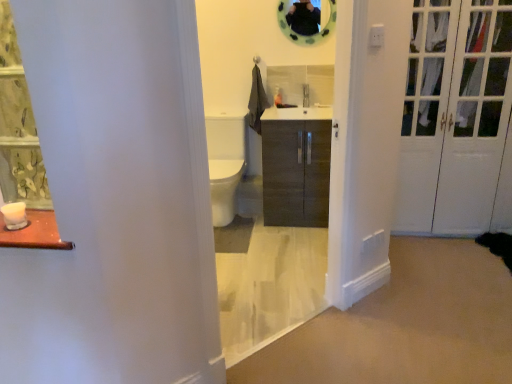
Question: From the image's perspective, is white glossy door at right located above green rubber mirror at upper center?

Choices:
 (A) yes
 (B) no

Answer: (B)

Question: From the image's perspective, is white glossy door at right under green rubber mirror at upper center?

Choices:
 (A) yes
 (B) no

Answer: (A)

Question: Would you say green rubber mirror at upper center is part of white glossy door at right's contents?

Choices:
 (A) yes
 (B) no

Answer: (B)

Question: Does white glossy door at right have a greater width compared to green rubber mirror at upper center?

Choices:
 (A) no
 (B) yes

Answer: (B)

Question: Considering the relative positions of white glossy door at right and green rubber mirror at upper center in the image provided, is white glossy door at right behind green rubber mirror at upper center?

Choices:
 (A) no
 (B) yes

Answer: (A)

Question: Does white glossy door at right come in front of green rubber mirror at upper center?

Choices:
 (A) no
 (B) yes

Answer: (B)

Question: Is matte wood cabinet at center closer to camera compared to white glossy door at right?

Choices:
 (A) no
 (B) yes

Answer: (B)

Question: Is matte wood cabinet at center far away from white glossy door at right?

Choices:
 (A) no
 (B) yes

Answer: (A)

Question: Can you confirm if matte wood cabinet at center is smaller than white glossy door at right?

Choices:
 (A) no
 (B) yes

Answer: (B)

Question: Does matte wood cabinet at center have a lesser height compared to white glossy door at right?

Choices:
 (A) no
 (B) yes

Answer: (B)

Question: Does matte wood cabinet at center contain white glossy door at right?

Choices:
 (A) no
 (B) yes

Answer: (A)

Question: Is matte wood cabinet at center facing towards white glossy door at right?

Choices:
 (A) no
 (B) yes

Answer: (A)

Question: Is green floral fabric curtain at left far from matte wood cabinet at center?

Choices:
 (A) no
 (B) yes

Answer: (B)